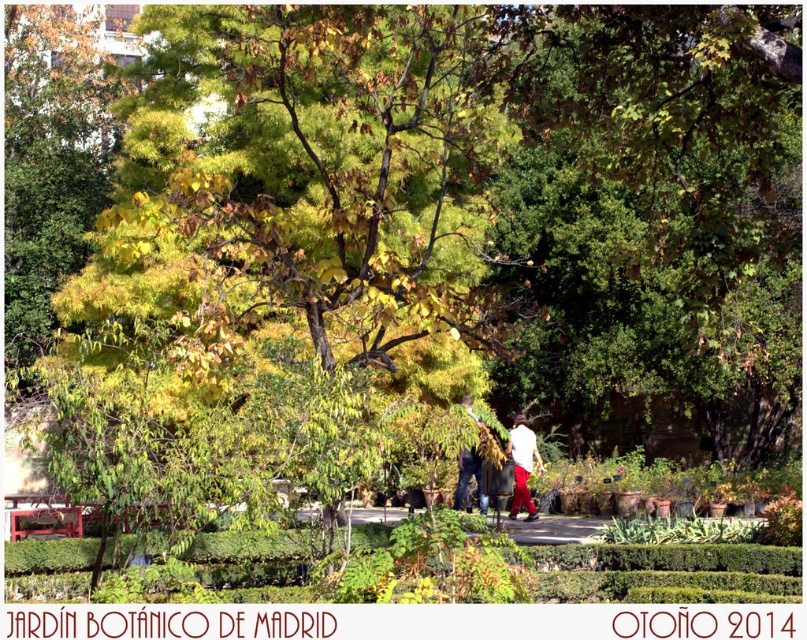
You are standing at the entrance of the Jard?n Bot?nico de Madrid during autumn and see two points marked in the garden. One is at point (789, 92) and the other is at point (513, 506). Which point is closer to your current position?

Point (789, 92) is closer to the camera than point (513, 506), so the point at (789, 92) is closer to your current position.

You are standing in the Jardn Botnico de Madrid during autumn. You see a green leafy tree at center and a white matte shirt at center. Which object is higher in the scene?

The green leafy tree at center is above the white matte shirt at center, so the green leafy tree at center is higher in the scene.